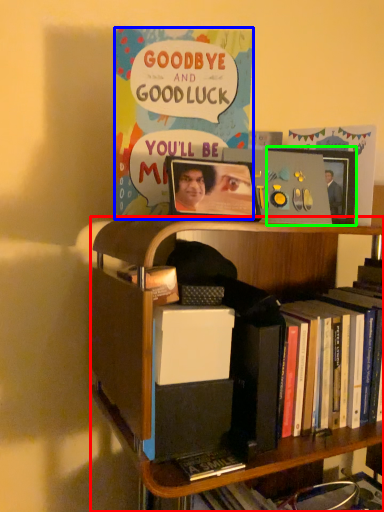
Question: Which object is the farthest from bookcase (highlighted by a red box)? Choose among these: comic book (highlighted by a blue box) or picture frame (highlighted by a green box).

Choices:
 (A) comic book
 (B) picture frame

Answer: (B)